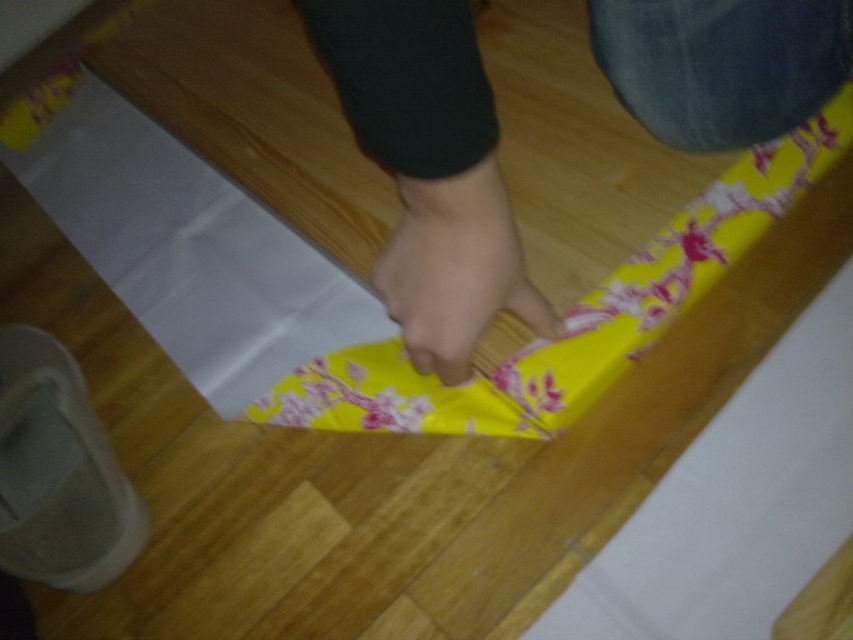
Does white paper at center have a smaller size compared to smooth skin hand at center?

No.

Which is below, white paper at center or smooth skin hand at center?

smooth skin hand at center is below.

This screenshot has width=853, height=640. In order to click on white paper at center in this screenshot , I will do `click(209, 269)`.

Where is `white paper at center`? The height and width of the screenshot is (640, 853). white paper at center is located at coordinates (209, 269).

What do you see at coordinates (430, 170) in the screenshot?
I see `yellow floral fabric at center` at bounding box center [430, 170].

Is yellow floral fabric at center shorter than smooth skin hand at center?

Yes, yellow floral fabric at center is shorter than smooth skin hand at center.

From the picture: Who is more distant from viewer, (427, 44) or (451, 332)?

Point (451, 332)

Locate an element on the screen. The height and width of the screenshot is (640, 853). yellow floral fabric at center is located at coordinates (430, 170).

Does point (488, 232) come closer to viewer compared to point (349, 314)?

Yes, point (488, 232) is in front of point (349, 314).

Can you confirm if yellow floral fabric at center is smaller than white paper at center?

Yes.

Identify the location of yellow floral fabric at center. coord(430,170).

What are the coordinates of `yellow floral fabric at center` in the screenshot? It's located at (430, 170).